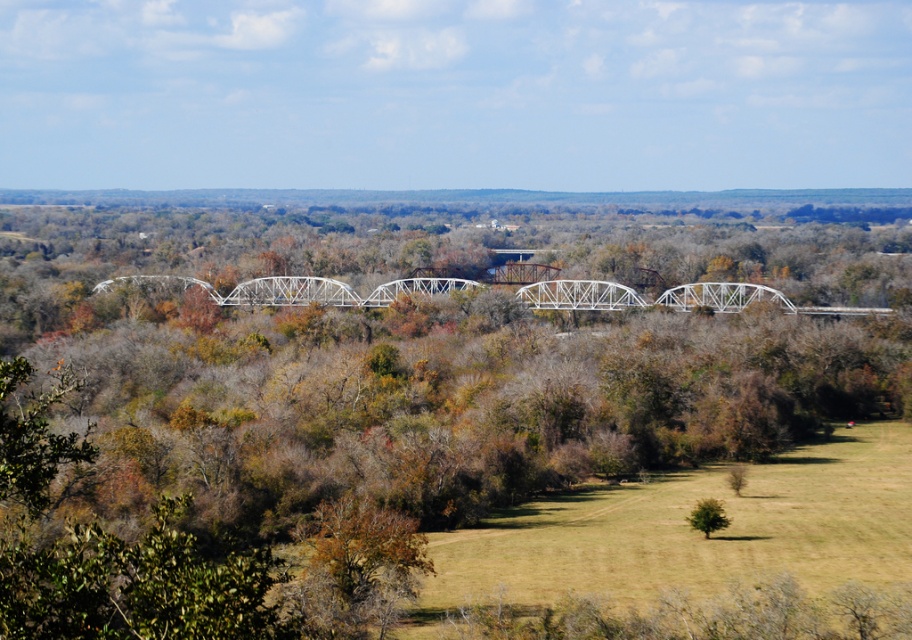
Is green grassy field at lower right in front of green matte tree at center?

Yes, green grassy field at lower right is in front of green matte tree at center.

Can you confirm if green grassy field at lower right is shorter than green matte tree at center?

No, green grassy field at lower right is not shorter than green matte tree at center.

Image resolution: width=912 pixels, height=640 pixels. What are the coordinates of `green grassy field at lower right` in the screenshot? It's located at (692, 532).

Between point (431, 237) and point (714, 522), which one is positioned behind?

Point (431, 237)

You are a GUI agent. You are given a task and a screenshot of the screen. Output one action in this format:
    pyautogui.click(x=<x>, y=<y>)
    Task: Click on the green leafy tree at center
    
    Given the screenshot: What is the action you would take?
    pyautogui.click(x=457, y=406)

Can you confirm if green leafy tree at center is taller than white metallic bridge at center?

Indeed, green leafy tree at center has a greater height compared to white metallic bridge at center.

Is green leafy tree at center shorter than white metallic bridge at center?

No.

At what (x,y) coordinates should I click in order to perform the action: click on green leafy tree at center. Please return your answer as a coordinate pair (x, y). This screenshot has width=912, height=640. Looking at the image, I should click on (457, 406).